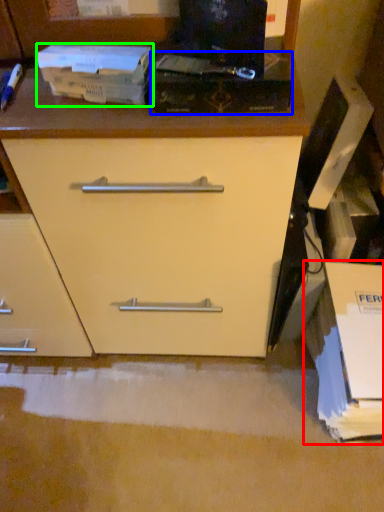
Question: Which is nearer to the cardboard box (highlighted by a red box)? paperback book (highlighted by a blue box) or paperback book (highlighted by a green box).

Choices:
 (A) paperback book
 (B) paperback book

Answer: (A)